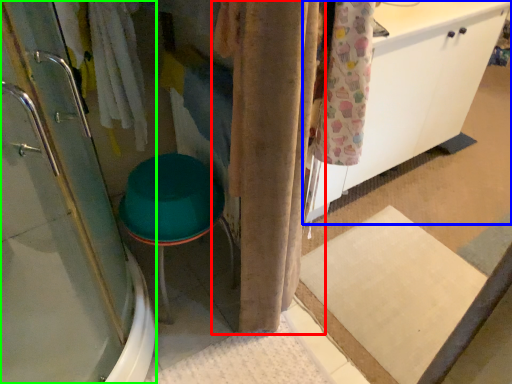
Question: Considering the real-world distances, which object is closest to curtain (highlighted by a red box)? cabinetry (highlighted by a blue box) or shower door (highlighted by a green box).

Choices:
 (A) cabinetry
 (B) shower door

Answer: (B)